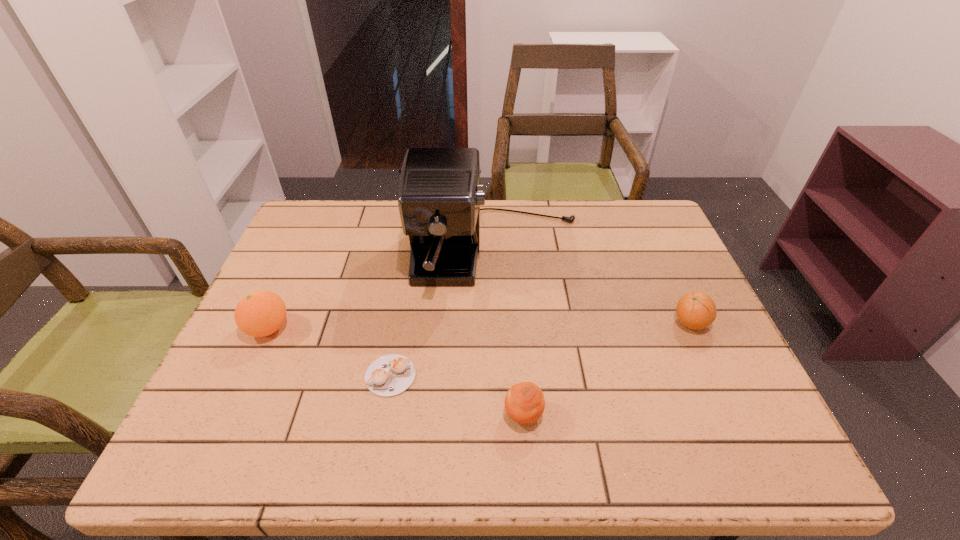
The width and height of the screenshot is (960, 540). I want to click on vacant position at the far right corner of the desktop, so click(634, 206).

Find the location of `vacant space at the near right corner of the desktop`. vacant space at the near right corner of the desktop is located at coordinates (693, 440).

Locate an element on the screen. vacant area between the tallest object and the second orange from right to left is located at coordinates (510, 334).

Image resolution: width=960 pixels, height=540 pixels. I want to click on unoccupied area between the second orange from right to left and the shortest object, so click(x=457, y=395).

Locate an element on the screen. Image resolution: width=960 pixels, height=540 pixels. unoccupied position between the shortest object and the fourth shortest object is located at coordinates (329, 352).

Find the location of a particular element. The height and width of the screenshot is (540, 960). free space between the shortest object and the second tallest object is located at coordinates (329, 352).

Where is `empty space between the tallest object and the nearest orange`? empty space between the tallest object and the nearest orange is located at coordinates (510, 334).

I want to click on vacant area that lies between the rightmost object and the tallest orange, so click(479, 326).

Where is `free space between the coffee maker and the nearest orange`? The image size is (960, 540). free space between the coffee maker and the nearest orange is located at coordinates (510, 334).

Where is `vacant space in between the second orange from left to right and the shortest object`? The image size is (960, 540). vacant space in between the second orange from left to right and the shortest object is located at coordinates (457, 395).